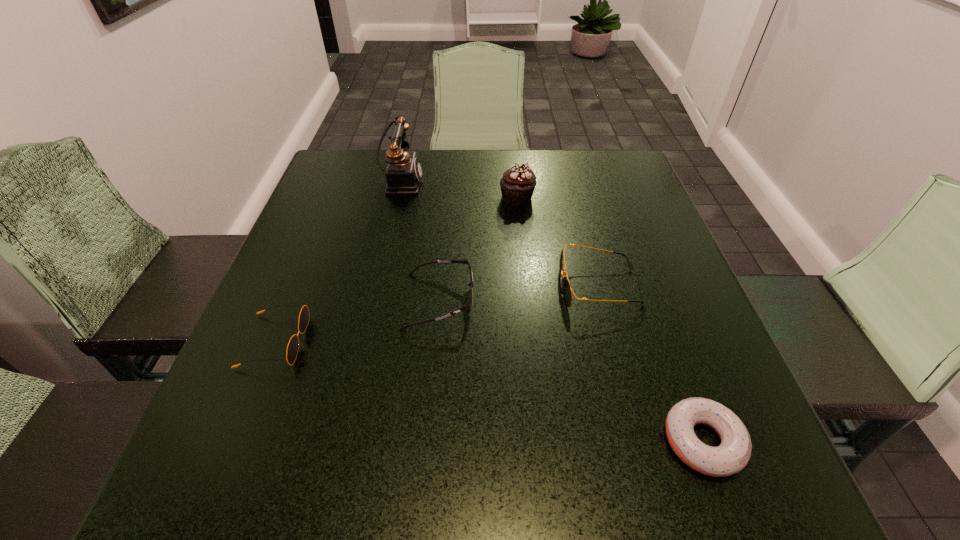
Locate an element on the screen. This screenshot has width=960, height=540. sunglasses located at the left edge is located at coordinates (292, 349).

Locate an element on the screen. The image size is (960, 540). sunglasses positioned at the right edge is located at coordinates (567, 291).

You are a GUI agent. You are given a task and a screenshot of the screen. Output one action in this format:
    pyautogui.click(x=<x>, y=<y>)
    Task: Click on the doughnut located at the right edge
    The height and width of the screenshot is (540, 960).
    Given the screenshot: What is the action you would take?
    pyautogui.click(x=732, y=455)

Locate an element on the screen. The image size is (960, 540). object at the far left corner is located at coordinates (404, 173).

Where is `object at the near right corner`? object at the near right corner is located at coordinates pos(732,455).

I want to click on vacant position at the far edge of the desktop, so (x=386, y=181).

Find the location of a particular element. The width and height of the screenshot is (960, 540). vacant space at the near edge of the desktop is located at coordinates (636, 500).

Where is `free space at the left edge of the desktop`? free space at the left edge of the desktop is located at coordinates (269, 345).

You are a GUI agent. You are given a task and a screenshot of the screen. Output one action in this format:
    pyautogui.click(x=<x>, y=<y>)
    Task: Click on the vacant space at the far left corner of the desktop
    
    Given the screenshot: What is the action you would take?
    pyautogui.click(x=346, y=192)

Where is `vacant region at the far right corner of the desktop`? vacant region at the far right corner of the desktop is located at coordinates (580, 164).